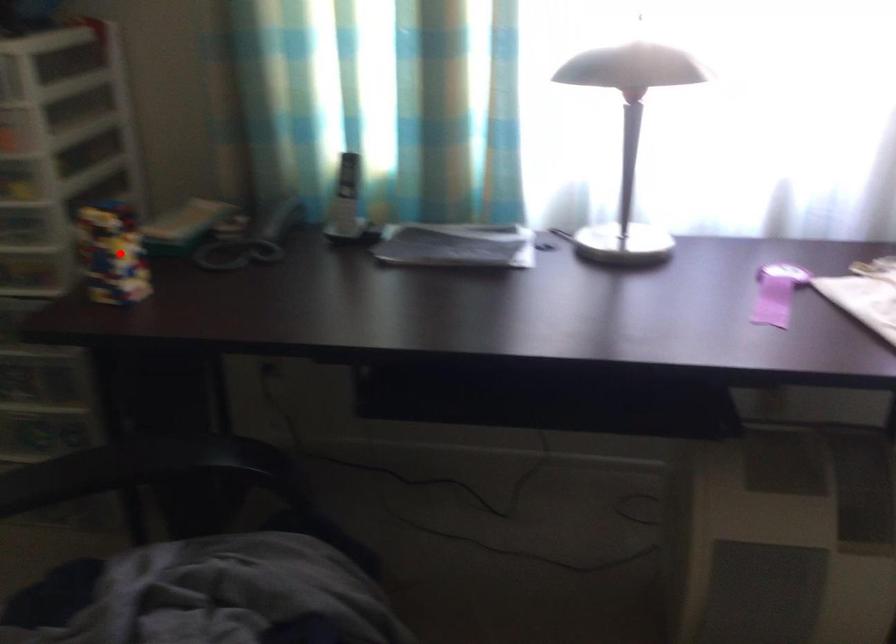
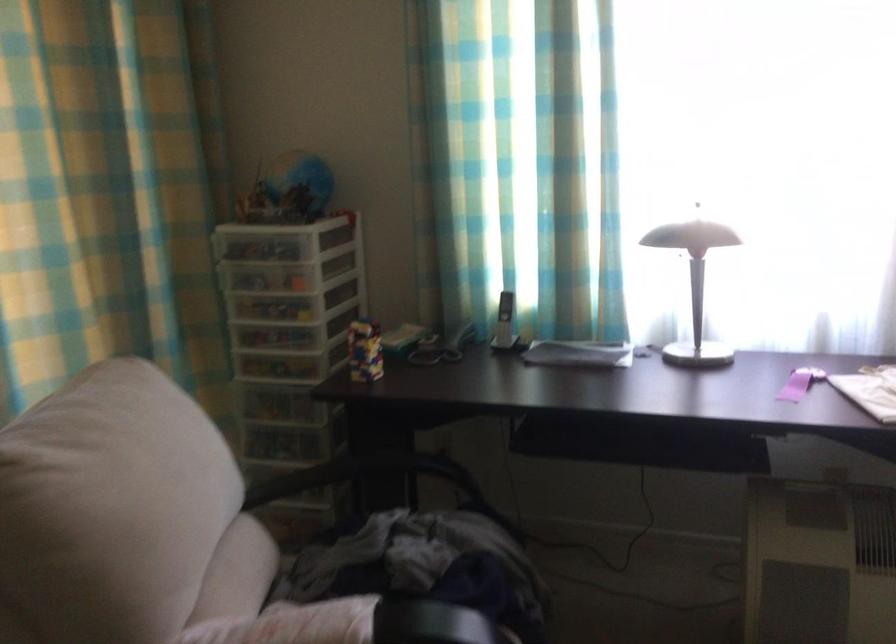
Find the pixel in the second image that matches the highlighted location in the first image.

(365, 351)